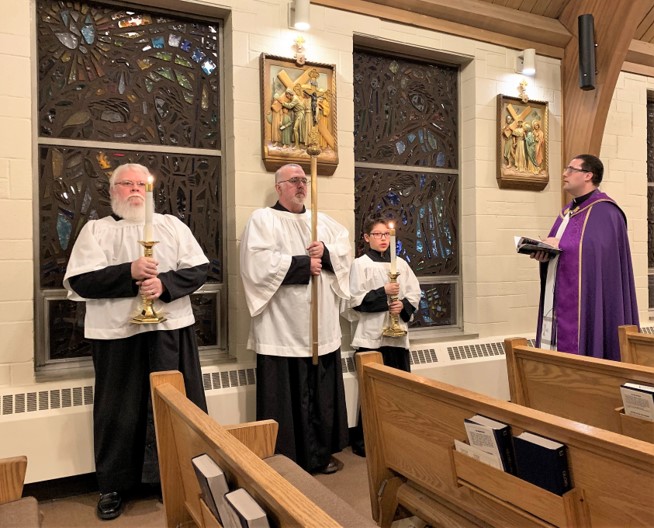
Locate an element on the screen. The image size is (654, 528). book is located at coordinates (205, 473), (245, 499), (542, 464), (505, 427), (639, 386), (518, 246).